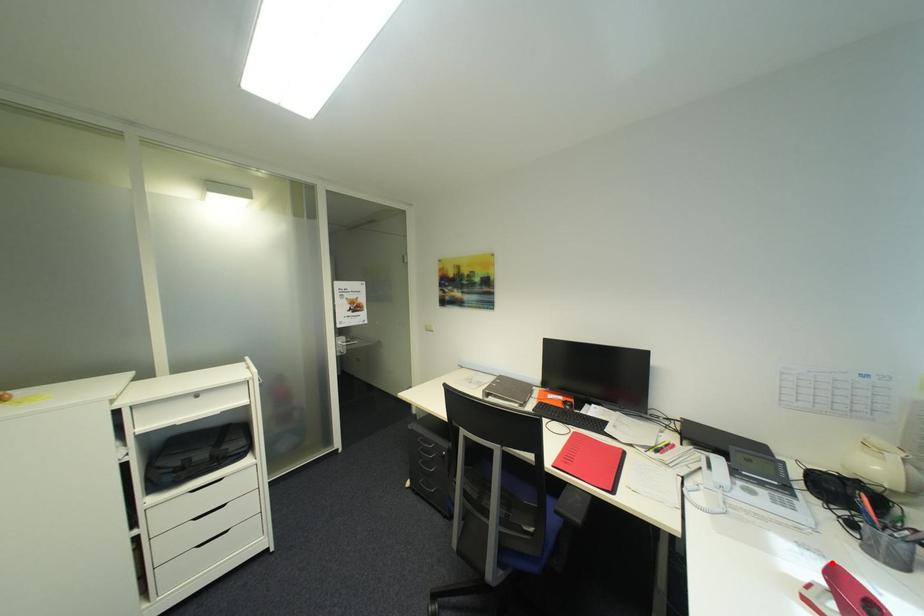
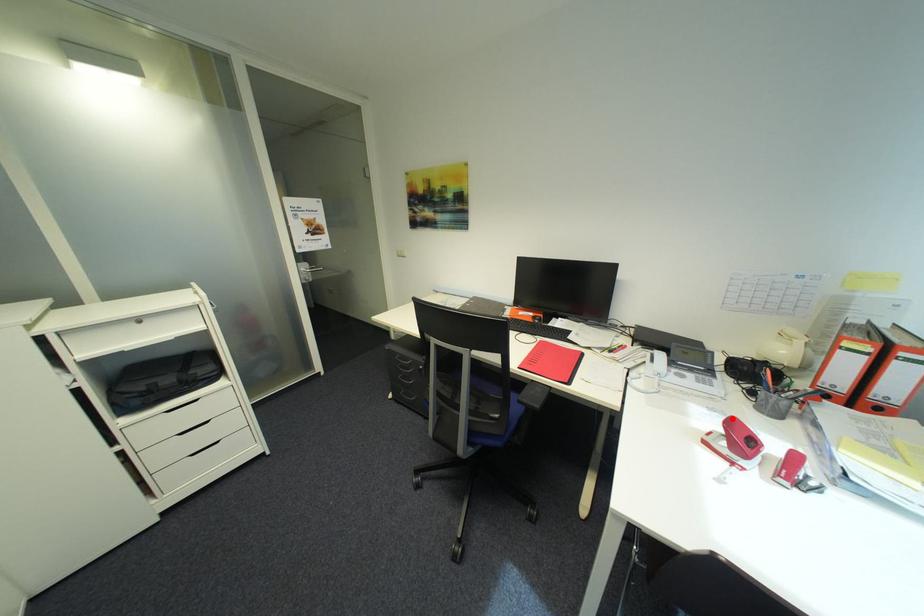
I am providing you with two images of the same scene from different viewpoints. A red point is marked on the first image and another point is marked on the second image. Do the highlighted points in image1 and image2 indicate the same real-world spot?

Yes